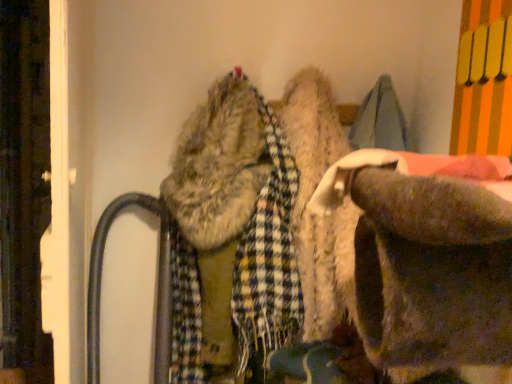
What do you see at coordinates (24, 185) in the screenshot? The image size is (512, 384). I see `wooden door at left` at bounding box center [24, 185].

At what (x,y) coordinates should I click in order to perform the action: click on wooden door at left. Please return your answer as a coordinate pair (x, y). This screenshot has width=512, height=384. Looking at the image, I should click on (24, 185).

Locate an element on the screen. wooden door at left is located at coordinates [x=24, y=185].